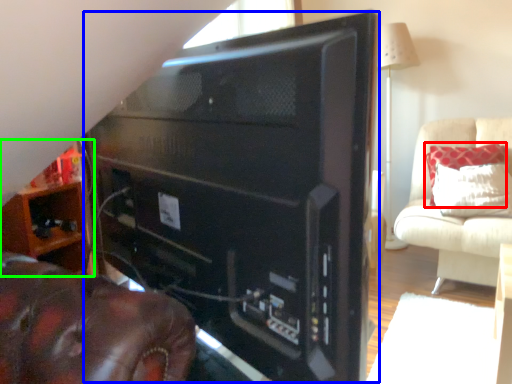
Question: Which object is positioned closest to pillow (highlighted by a red box)? Select from desktop computer (highlighted by a blue box) and furniture (highlighted by a green box).

Choices:
 (A) desktop computer
 (B) furniture

Answer: (A)